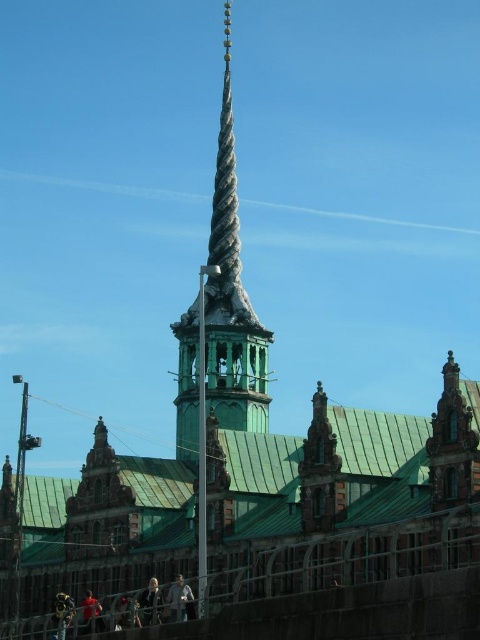
Question: From the image, what is the correct spatial relationship of green copper roof at center in relation to green wooden spire at center?

Choices:
 (A) right
 (B) left

Answer: (A)

Question: Where is green copper roof at center located in relation to green wooden spire at center in the image?

Choices:
 (A) right
 (B) left

Answer: (A)

Question: Among these points, which one is nearest to the camera?

Choices:
 (A) (247, 312)
 (B) (384, 456)

Answer: (B)

Question: Can you confirm if green copper roof at center is wider than green wooden spire at center?

Choices:
 (A) no
 (B) yes

Answer: (B)

Question: Which point appears closest to the camera in this image?

Choices:
 (A) (365, 477)
 (B) (239, 352)

Answer: (A)